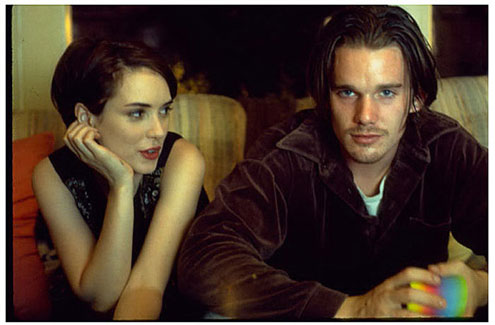
Identify the location of yellow wall. Image resolution: width=495 pixels, height=325 pixels. (39, 18), (422, 17).